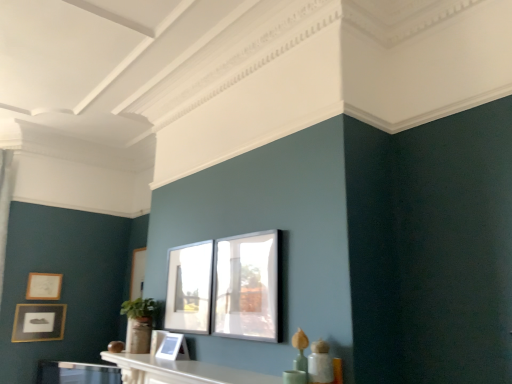
This screenshot has width=512, height=384. What do you see at coordinates (226, 287) in the screenshot?
I see `matte glass picture frame at center, which is the fourth picture frame in back-to-front order` at bounding box center [226, 287].

This screenshot has width=512, height=384. Describe the element at coordinates (172, 347) in the screenshot. I see `matte white picture frame at center, which is the 2th picture frame from right to left` at that location.

This screenshot has height=384, width=512. In order to click on matte white picture frame at center, which is the 2th picture frame from right to left in this screenshot , I will do `click(172, 347)`.

The width and height of the screenshot is (512, 384). Describe the element at coordinates (189, 288) in the screenshot. I see `clear glass window at center` at that location.

What are the coordinates of `matte glass picture frame at center, placed as the fourth picture frame when sorted from left to right` in the screenshot? It's located at (226, 287).

How many degrees apart are the facing directions of clear glass window at center and matte gold picture frame at left, arranged as the 4th picture frame when viewed from the front?

90.3 degrees separate the facing orientations of clear glass window at center and matte gold picture frame at left, arranged as the 4th picture frame when viewed from the front.

Which is behind, clear glass window at center or matte gold picture frame at left, arranged as the 4th picture frame when viewed from the front?

Positioned behind is matte gold picture frame at left, arranged as the 4th picture frame when viewed from the front.

The width and height of the screenshot is (512, 384). I want to click on the 2nd picture frame to the left of the clear glass window at center, counting from the anchor's position, so click(x=44, y=286).

Image resolution: width=512 pixels, height=384 pixels. In order to click on window located above the matte glass picture frame at center, which is the fourth picture frame in back-to-front order (from a real-world perspective) in this screenshot , I will do `click(189, 288)`.

From a real-world perspective, does matte glass picture frame at center, placed as the fourth picture frame when sorted from left to right, sit lower than clear glass window at center?

Yes, from a real-world perspective, matte glass picture frame at center, placed as the fourth picture frame when sorted from left to right, is under clear glass window at center.

Could you measure the distance between matte glass picture frame at center, arranged as the 1th picture frame when viewed from the front, and clear glass window at center?

matte glass picture frame at center, arranged as the 1th picture frame when viewed from the front, and clear glass window at center are 4.45 inches apart from each other.

Is matte glass picture frame at center, which is the fourth picture frame in back-to-front order, thinner than clear glass window at center?

No, matte glass picture frame at center, which is the fourth picture frame in back-to-front order, is not thinner than clear glass window at center.

Considering the sizes of clear glass window at center and white marble mantel at lower center in the image, is clear glass window at center taller or shorter than white marble mantel at lower center?

In the image, clear glass window at center appears to be taller than white marble mantel at lower center.

Considering the positions of objects clear glass window at center and white marble mantel at lower center in the image provided, who is more to the right, clear glass window at center or white marble mantel at lower center?

From the viewer's perspective, white marble mantel at lower center appears more on the right side.

Are clear glass window at center and white marble mantel at lower center making contact?

No.

In terms of width, does clear glass window at center look wider or thinner when compared to white marble mantel at lower center?

Clearly, clear glass window at center has less width compared to white marble mantel at lower center.

Is matte gold picture frame at left, the second picture frame when ordered from left to right, to the right of white marble mantel at lower center from the viewer's perspective?

No.

In terms of height, does matte gold picture frame at left, arranged as the 3th picture frame when viewed from the right, look taller or shorter compared to white marble mantel at lower center?

matte gold picture frame at left, arranged as the 3th picture frame when viewed from the right, is taller than white marble mantel at lower center.

Looking at this image, would you consider matte gold picture frame at left, arranged as the 3th picture frame when viewed from the right, to be distant from white marble mantel at lower center?

Yes, matte gold picture frame at left, arranged as the 3th picture frame when viewed from the right, and white marble mantel at lower center are quite far apart.

From the image's perspective, which is above, clear glass window at center or matte glass picture frame at center, which appears as the 1th picture frame when viewed from the right?

matte glass picture frame at center, which appears as the 1th picture frame when viewed from the right, from the image's perspective.

Is clear glass window at center located outside matte glass picture frame at center, which appears as the 1th picture frame when viewed from the right?

Absolutely, clear glass window at center is external to matte glass picture frame at center, which appears as the 1th picture frame when viewed from the right.

Is clear glass window at center oriented towards matte glass picture frame at center, which is the fourth picture frame in back-to-front order?

No.

Which is further, (173,345) or (242,253)?

Positioned behind is point (173,345).

Can you tell me how much matte white picture frame at center, which is the 2th picture frame from right to left, and matte glass picture frame at center, which appears as the 1th picture frame when viewed from the right, differ in facing direction?

The angular difference between matte white picture frame at center, which is the 2th picture frame from right to left, and matte glass picture frame at center, which appears as the 1th picture frame when viewed from the right, is 1.61 degrees.

Does matte white picture frame at center, arranged as the third picture frame when viewed from the back, appear on the left side of matte glass picture frame at center, which appears as the 1th picture frame when viewed from the right?

Correct, you'll find matte white picture frame at center, arranged as the third picture frame when viewed from the back, to the left of matte glass picture frame at center, which appears as the 1th picture frame when viewed from the right.

Which of these two, matte white picture frame at center, arranged as the third picture frame when viewed from the back, or matte glass picture frame at center, arranged as the 1th picture frame when viewed from the front, is thinner?

matte glass picture frame at center, arranged as the 1th picture frame when viewed from the front, is thinner.

Measure the distance between matte glass picture frame at center, which appears as the 1th picture frame when viewed from the right, and matte white picture frame at center, which ranks as the second picture frame in front-to-back order.

45.38 centimeters.

Who is shorter, matte glass picture frame at center, which appears as the 1th picture frame when viewed from the right, or matte white picture frame at center, which is the 2th picture frame from right to left?

With less height is matte white picture frame at center, which is the 2th picture frame from right to left.

Considering the positions of objects matte glass picture frame at center, which appears as the 1th picture frame when viewed from the right, and matte white picture frame at center, the 3th picture frame when ordered from left to right, in the image provided, who is more to the right, matte glass picture frame at center, which appears as the 1th picture frame when viewed from the right, or matte white picture frame at center, the 3th picture frame when ordered from left to right,?

matte glass picture frame at center, which appears as the 1th picture frame when viewed from the right.

Is matte glass picture frame at center, which appears as the 1th picture frame when viewed from the right, turned away from matte white picture frame at center, which ranks as the second picture frame in front-to-back order?

No, matte glass picture frame at center, which appears as the 1th picture frame when viewed from the right,'s orientation is not away from matte white picture frame at center, which ranks as the second picture frame in front-to-back order.

Find the location of `window located in front of the matte gold picture frame at left, arranged as the 4th picture frame when viewed from the front`. window located in front of the matte gold picture frame at left, arranged as the 4th picture frame when viewed from the front is located at coordinates (189, 288).

The width and height of the screenshot is (512, 384). In order to click on window behind the matte glass picture frame at center, which is the fourth picture frame in back-to-front order in this screenshot , I will do `click(189, 288)`.

Considering their positions, is matte white picture frame at center, which ranks as the second picture frame in front-to-back order, positioned closer to matte gold picture frame at lower left, which is the fourth picture frame from right to left, than clear glass window at center?

The object closer to matte gold picture frame at lower left, which is the fourth picture frame from right to left, is matte white picture frame at center, which ranks as the second picture frame in front-to-back order.

Considering their positions, is matte gold picture frame at left, arranged as the 4th picture frame when viewed from the front, positioned closer to clear glass window at center than white marble mantel at lower center?

white marble mantel at lower center.

From the image, which object appears to be farther from clear glass window at center, matte gold picture frame at lower left, which is counted as the 3th picture frame, starting from the front, or white marble mantel at lower center?

Based on the image, matte gold picture frame at lower left, which is counted as the 3th picture frame, starting from the front, appears to be further to clear glass window at center.

Based on their spatial positions, is matte gold picture frame at left, the second picture frame when ordered from left to right, or matte white picture frame at center, which is the 2th picture frame from right to left, closer to white marble mantel at lower center?

matte white picture frame at center, which is the 2th picture frame from right to left, is closer to white marble mantel at lower center.

When comparing their distances from matte gold picture frame at left, arranged as the 4th picture frame when viewed from the front, does matte gold picture frame at lower left, which is the fourth picture frame from right to left, or clear glass window at center seem closer?

matte gold picture frame at lower left, which is the fourth picture frame from right to left, is closer to matte gold picture frame at left, arranged as the 4th picture frame when viewed from the front.

From the image, which object appears to be farther from matte glass picture frame at center, which appears as the 1th picture frame when viewed from the right, matte white picture frame at center, which is the 2th picture frame from right to left, or clear glass window at center?

Based on the image, matte white picture frame at center, which is the 2th picture frame from right to left, appears to be further to matte glass picture frame at center, which appears as the 1th picture frame when viewed from the right.

Which object lies nearer to the anchor point matte glass picture frame at center, placed as the fourth picture frame when sorted from left to right, matte gold picture frame at left, the first picture frame viewed from the back, or white marble mantel at lower center?

Among the two, white marble mantel at lower center is located nearer to matte glass picture frame at center, placed as the fourth picture frame when sorted from left to right.

Based on their spatial positions, is matte gold picture frame at lower left, which is the fourth picture frame from right to left, or clear glass window at center closer to matte glass picture frame at center, arranged as the 1th picture frame when viewed from the front?

Among the two, clear glass window at center is located nearer to matte glass picture frame at center, arranged as the 1th picture frame when viewed from the front.

The image size is (512, 384). What are the coordinates of `picture frame between matte gold picture frame at left, arranged as the 4th picture frame when viewed from the front, and clear glass window at center from left to right` in the screenshot? It's located at (172, 347).

You are a GUI agent. You are given a task and a screenshot of the screen. Output one action in this format:
    pyautogui.click(x=<x>, y=<y>)
    Task: Click on the window located between matte gold picture frame at lower left, which is counted as the second picture frame, starting from the back, and matte glass picture frame at center, which is the fourth picture frame in back-to-front order, in the left-right direction
    
    Given the screenshot: What is the action you would take?
    pyautogui.click(x=189, y=288)

Image resolution: width=512 pixels, height=384 pixels. In order to click on window between matte glass picture frame at center, arranged as the 1th picture frame when viewed from the front, and matte white picture frame at center, which is the 2th picture frame from right to left, in the front-back direction in this screenshot , I will do pos(189,288).

I want to click on window positioned between white marble mantel at lower center and matte gold picture frame at left, arranged as the 3th picture frame when viewed from the right, from near to far, so click(189, 288).